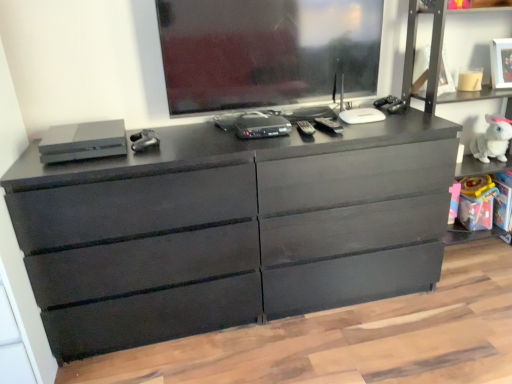
I want to click on vacant area to the right of matte black controller at center, marked as the 2th equipment in a left-to-right arrangement, so click(190, 141).